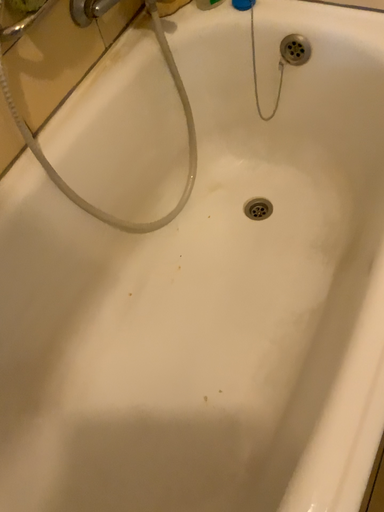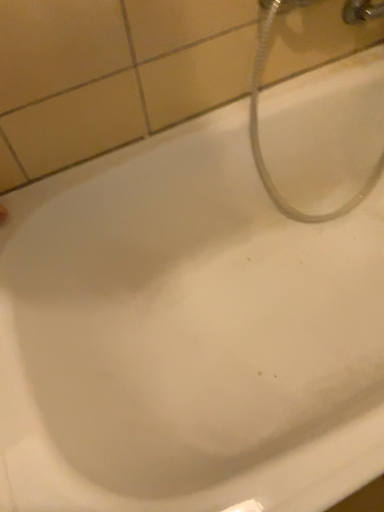
Question: Which way did the camera rotate in the video?

Choices:
 (A) rotated left
 (B) rotated right

Answer: (A)